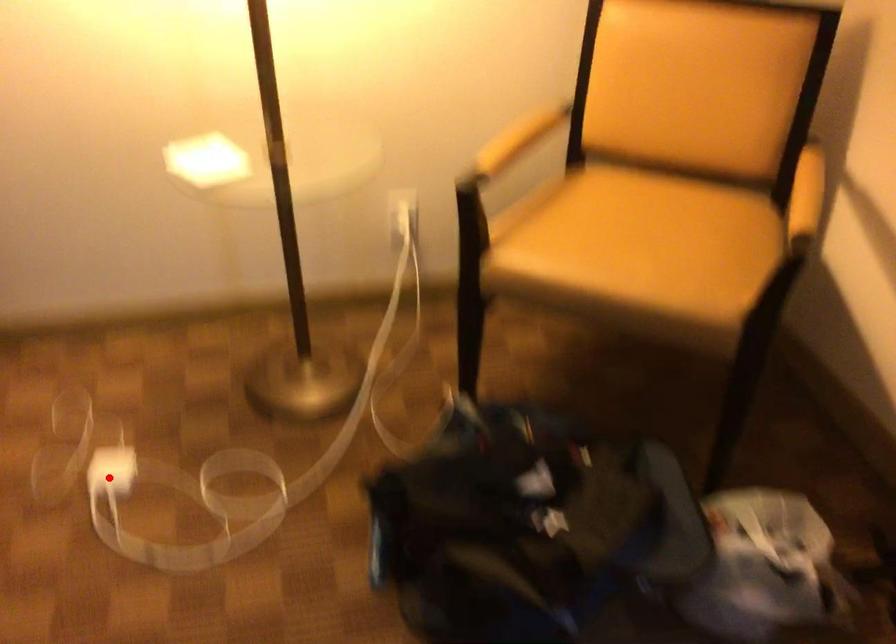
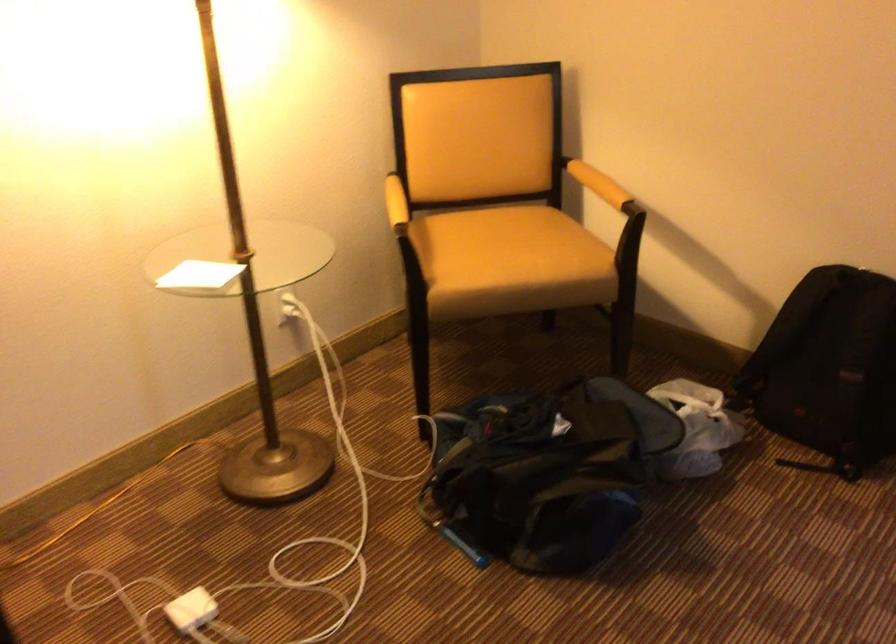
Find the pixel in the second image that matches the highlighted location in the first image.

(192, 609)